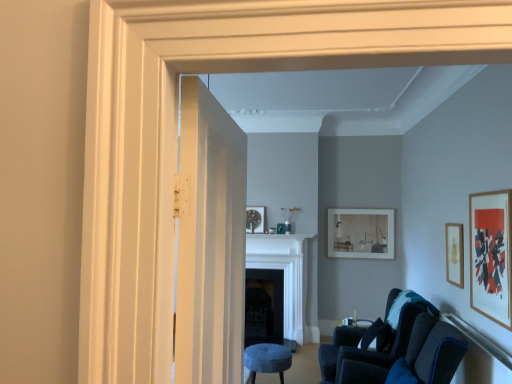
The image size is (512, 384). In order to click on vacant region above velvet blue stool at lower center (from a real-world perspective) in this screenshot , I will do `click(266, 350)`.